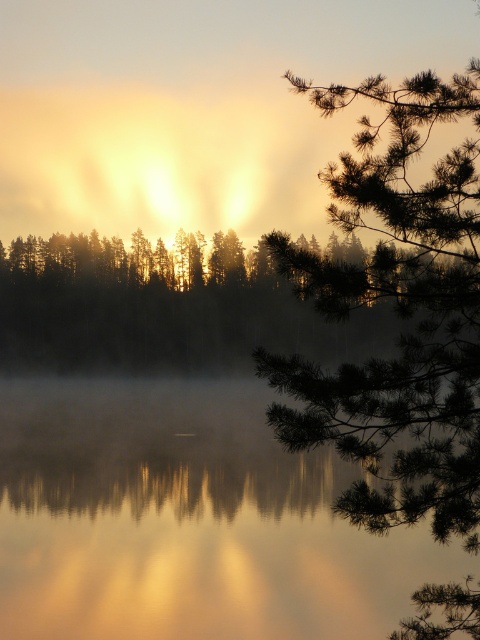
You are an artist trying to paint this scene. You want to ensure the glossy reflective water at center and the silvery metallic trees at center are proportionally accurate. Which object should you paint wider?

The glossy reflective water at center should be painted wider since its width is larger than the silvery metallic trees at center according to the description.

You are standing at the origin point of the coordinate system. Which direction should you move to reach the glossy reflective water at center?

The glossy reflective water at center is located at coordinate point 0.814 on the x axis and 0.390 on the y axis. To reach it from the origin, move right along the x axis to 0.814 and forward along the y axis to 0.390.